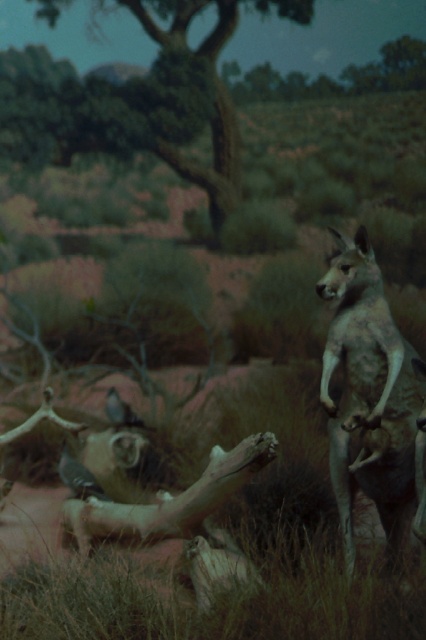
Question: Does green leafy tree at upper center have a greater width compared to matte gray bird at lower left?

Choices:
 (A) yes
 (B) no

Answer: (A)

Question: Can you confirm if smooth gray kangaroo at right is bigger than shiny blue bird at lower left?

Choices:
 (A) no
 (B) yes

Answer: (B)

Question: Which of these objects is positioned closest to the shiny blue bird at lower left?

Choices:
 (A) smooth gray kangaroo at right
 (B) matte gray bird at lower left
 (C) green leafy tree at upper center

Answer: (B)

Question: Which of the following is the farthest from the observer?

Choices:
 (A) smooth gray kangaroo at right
 (B) matte gray bird at lower left

Answer: (B)

Question: Is matte gray bird at lower left smaller than shiny blue bird at lower left?

Choices:
 (A) yes
 (B) no

Answer: (B)

Question: Which object is the closest to the shiny blue bird at lower left?

Choices:
 (A) matte gray bird at lower left
 (B) green leafy tree at upper center

Answer: (A)